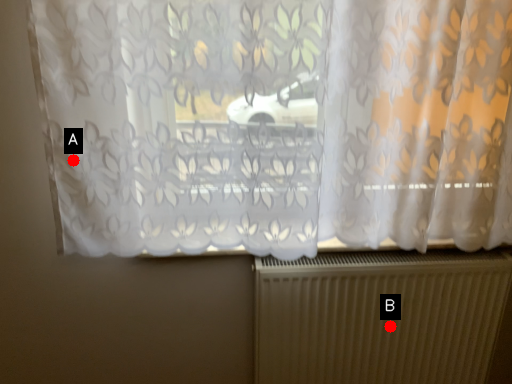
Question: Two points are circled on the image, labeled by A and B beside each circle. Which point is closer to the camera taking this photo?

Choices:
 (A) A is closer
 (B) B is closer

Answer: (A)